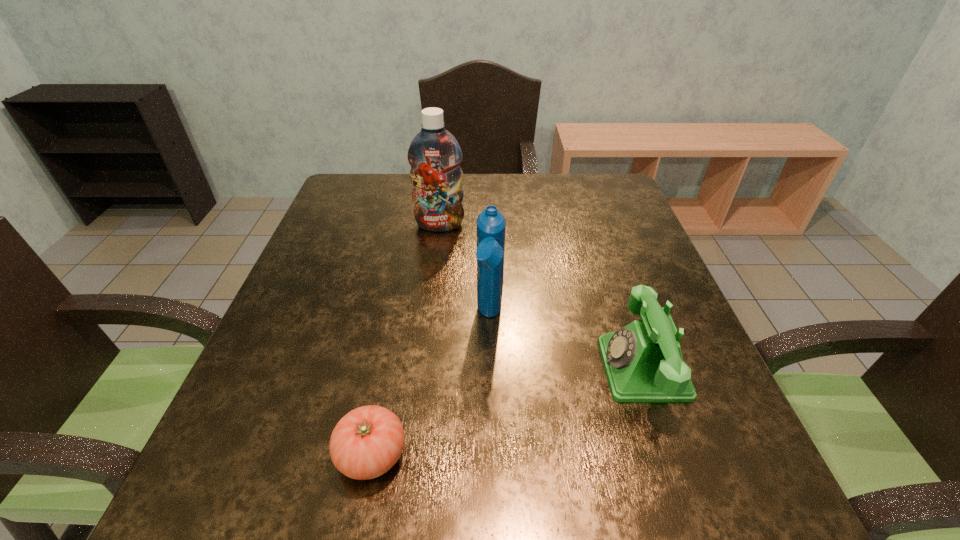
Where is `free region located on the dial of the telephone`? This screenshot has width=960, height=540. free region located on the dial of the telephone is located at coordinates (411, 369).

Find the location of `vacant area located on the dial of the telephone`. vacant area located on the dial of the telephone is located at coordinates (528, 369).

You are a GUI agent. You are given a task and a screenshot of the screen. Output one action in this format:
    pyautogui.click(x=<x>, y=<y>)
    Task: Click on the blank area located 0.050m on the right of the shortest object
    The image size is (960, 540).
    Given the screenshot: What is the action you would take?
    pyautogui.click(x=439, y=455)

Find the location of a particular element. This screenshot has width=960, height=540. object located at the near edge is located at coordinates click(367, 442).

Locate an element on the screen. The width and height of the screenshot is (960, 540). object that is at the right edge is located at coordinates (643, 362).

Locate an element on the screen. This screenshot has width=960, height=540. vacant region at the far edge of the desktop is located at coordinates (487, 190).

In the image, there is a desktop. Identify the location of vacant space at the near edge. (432, 472).

Locate an element on the screen. The height and width of the screenshot is (540, 960). free spot at the left edge of the desktop is located at coordinates (328, 357).

Where is `vacant space at the right edge of the desktop`? This screenshot has width=960, height=540. vacant space at the right edge of the desktop is located at coordinates point(644,404).

In the image, there is a desktop. Where is `vacant space at the far left corner`? vacant space at the far left corner is located at coordinates (338, 210).